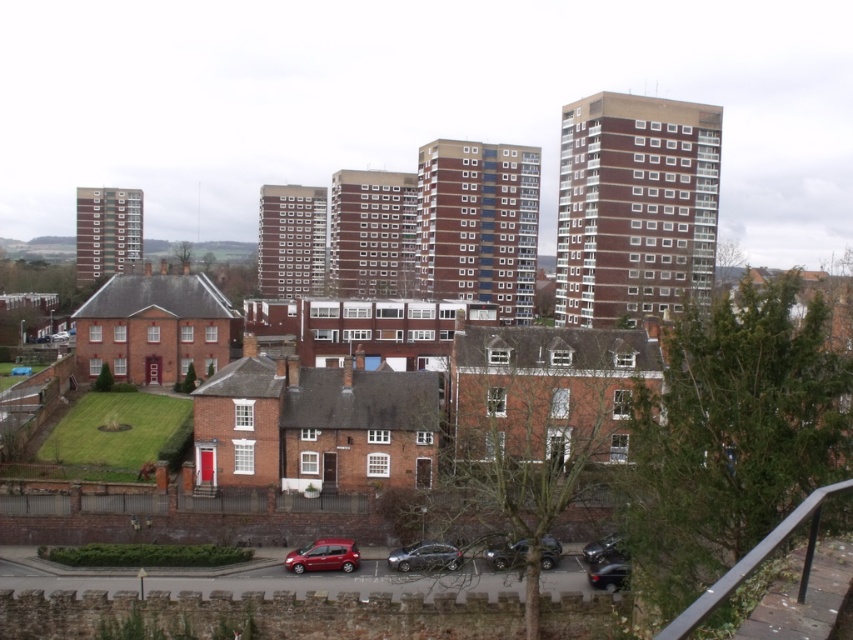
Does brick tower block at left have a greater height compared to shiny metallic car at lower right?

Correct, brick tower block at left is much taller as shiny metallic car at lower right.

Does point (135, 198) come farther from viewer compared to point (598, 552)?

Yes, it is.

Is point (103, 198) less distant than point (618, 532)?

No, it is not.

Identify the location of brick tower block at left. (107, 230).

Between shiny red car at lower center and shiny black car at lower center, which one appears on the right side from the viewer's perspective?

shiny black car at lower center is more to the right.

Does shiny red car at lower center lie in front of shiny black car at lower center?

No, shiny red car at lower center is behind shiny black car at lower center.

Who is more forward, (351, 548) or (596, 572)?

Point (596, 572) is more forward.

This screenshot has width=853, height=640. What are the coordinates of `shiny red car at lower center` in the screenshot? It's located at 323,556.

Between brown brick tower block at upper right and metallic gray car at lower center, which one appears on the right side from the viewer's perspective?

A: brown brick tower block at upper right is more to the right.

Looking at this image, does brown brick tower block at upper right have a lesser width compared to metallic gray car at lower center?

Incorrect, brown brick tower block at upper right's width is not less than metallic gray car at lower center's.

Is point (701, 176) closer to viewer compared to point (560, 548)?

No, it is not.

Locate an element on the screen. brown brick tower block at upper right is located at coordinates (634, 205).